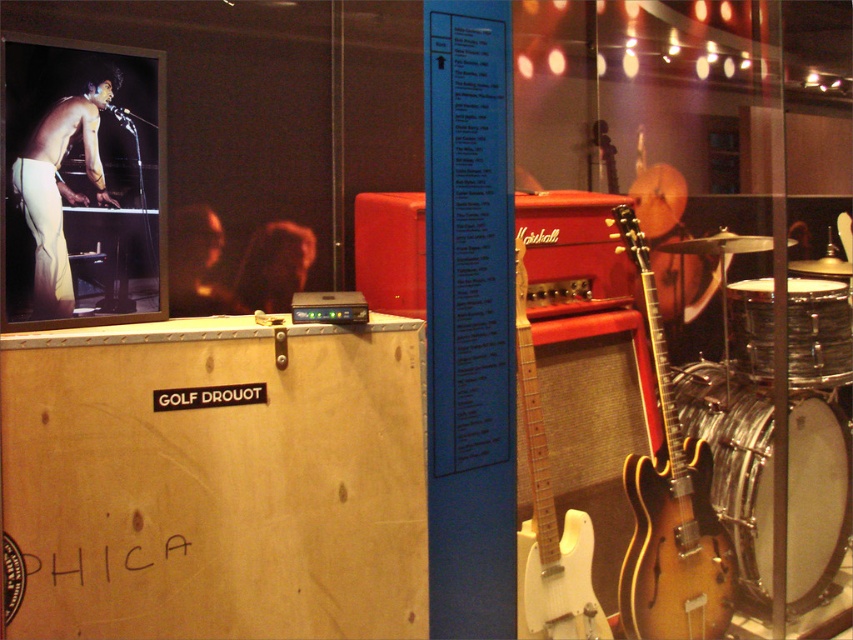
Does point (833, 540) come behind point (770, 305)?

Yes, point (833, 540) is behind point (770, 305).

Which is more to the left, white drum at lower right or shiny silver drum at right?

Positioned to the left is white drum at lower right.

You are a GUI agent. You are given a task and a screenshot of the screen. Output one action in this format:
    pyautogui.click(x=<x>, y=<y>)
    Task: Click on the white drum at lower right
    The image size is (853, 640).
    Given the screenshot: What is the action you would take?
    pyautogui.click(x=734, y=465)

Where is `white drum at lower right`? white drum at lower right is located at coordinates (734, 465).

The width and height of the screenshot is (853, 640). I want to click on white drum at lower right, so coord(734,465).

Can you confirm if white drum at lower right is positioned above matte white pants at left?

Actually, white drum at lower right is below matte white pants at left.

Is point (688, 397) in front of point (51, 268)?

No, (688, 397) is further to viewer.

In order to click on white drum at lower right in this screenshot , I will do `click(734, 465)`.

Does sunburst wood electric guitar at right lie in front of shiny silver drum at right?

Yes, it is.

Between sunburst wood electric guitar at right and shiny silver drum at right, which one has more height?

sunburst wood electric guitar at right is taller.

Locate an element on the screen. The height and width of the screenshot is (640, 853). sunburst wood electric guitar at right is located at coordinates (670, 508).